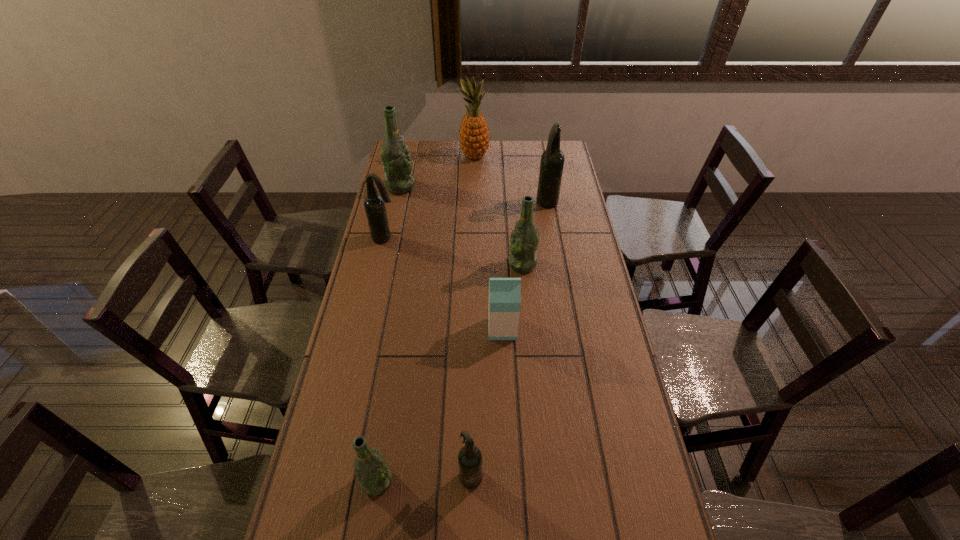
The height and width of the screenshot is (540, 960). I want to click on blank region between the fourth nearest beer bottle and the third nearest object, so click(444, 284).

You are a GUI agent. You are given a task and a screenshot of the screen. Output one action in this format:
    pyautogui.click(x=<x>, y=<y>)
    Task: Click on the vacant space that's between the farthest object and the second nearest dark beer bottle
    The height and width of the screenshot is (540, 960).
    Given the screenshot: What is the action you would take?
    pyautogui.click(x=430, y=198)

Where is `empty space that is in between the second nearest dark beer bottle and the second biggest green beer bottle`? empty space that is in between the second nearest dark beer bottle and the second biggest green beer bottle is located at coordinates (454, 252).

Where is `free space between the fifth beer bottle from left to right and the fifth nearest object`? free space between the fifth beer bottle from left to right and the fifth nearest object is located at coordinates (454, 252).

At what (x,y) coordinates should I click in order to perform the action: click on vacant area that lies between the farthest object and the sixth nearest object. Please return your answer as a coordinate pair (x, y). The image size is (960, 540). Looking at the image, I should click on (511, 180).

Find the location of a particular element. This screenshot has width=960, height=540. free space between the third beer bottle from right to left and the pineapple is located at coordinates [x=473, y=315].

The width and height of the screenshot is (960, 540). In order to click on unoccupied area between the milk carton and the leftmost dark beer bottle in this screenshot , I will do `click(444, 284)`.

The width and height of the screenshot is (960, 540). I want to click on vacant point located between the smallest green beer bottle and the farthest green beer bottle, so click(389, 334).

Where is `free space between the farthest object and the nearest green beer bottle`? free space between the farthest object and the nearest green beer bottle is located at coordinates (426, 319).

Locate which object ranks seventh in proximity to the second nearest dark beer bottle. Please provide its 2D coordinates. Your answer should be formatted as a tuple, i.e. [(x, y)], where the tuple contains the x and y coordinates of a point satisfying the conditions above.

[(470, 457)]